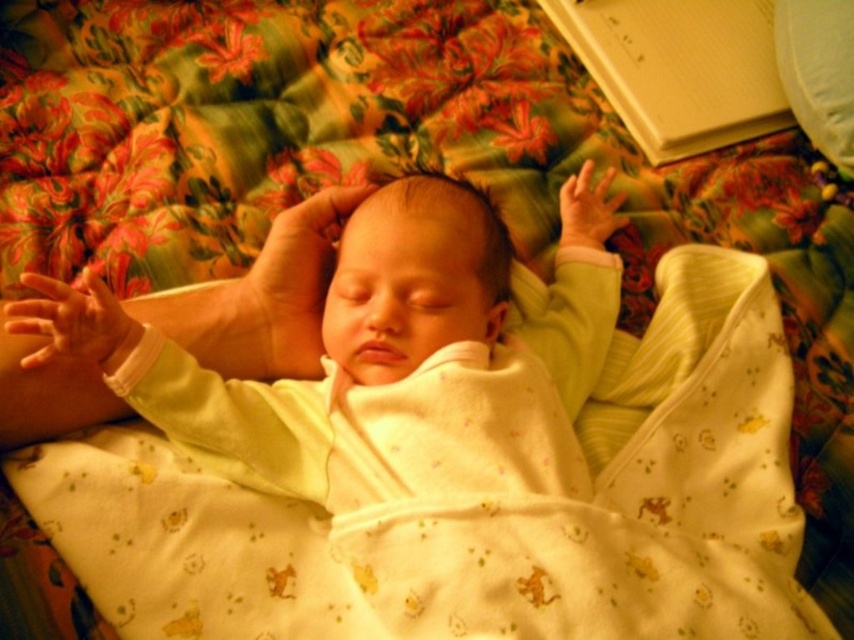
Question: Which point is closer to the camera?

Choices:
 (A) (814, 141)
 (B) (575, 289)

Answer: (B)

Question: Is soft yellow fabric baby at center thinner than white soft pillow at upper right?

Choices:
 (A) no
 (B) yes

Answer: (A)

Question: Which point is farther to the camera?

Choices:
 (A) (831, 120)
 (B) (151, 337)

Answer: (A)

Question: Among these objects, which one is farthest from the camera?

Choices:
 (A) white soft pillow at upper right
 (B) soft yellow fabric baby at center

Answer: (A)

Question: Is soft yellow fabric baby at center wider than white soft pillow at upper right?

Choices:
 (A) no
 (B) yes

Answer: (B)

Question: Is soft yellow fabric baby at center positioned in front of white soft pillow at upper right?

Choices:
 (A) yes
 (B) no

Answer: (A)